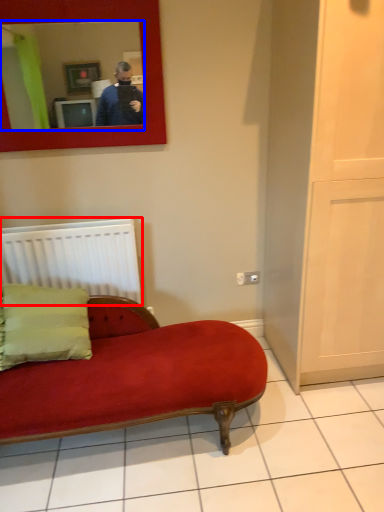
Question: Which object appears farthest to the camera in this image, radiator (highlighted by a red box) or mirror (highlighted by a blue box)?

Choices:
 (A) radiator
 (B) mirror

Answer: (A)